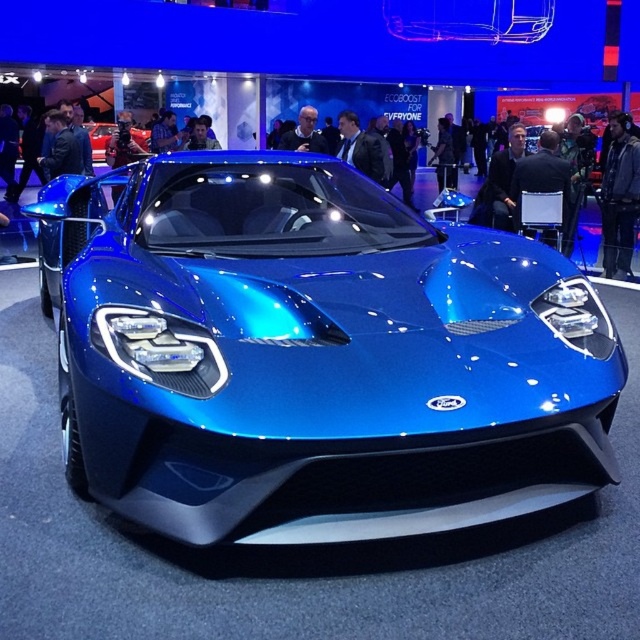
Question: Which point is farther to the camera?

Choices:
 (A) metallic blue car at center
 (B) metallic blue sports car at center

Answer: (A)

Question: Does metallic blue sports car at center appear under metallic blue car at center?

Choices:
 (A) yes
 (B) no

Answer: (A)

Question: Can you confirm if metallic blue sports car at center is wider than metallic blue car at center?

Choices:
 (A) no
 (B) yes

Answer: (B)

Question: Can you confirm if metallic blue sports car at center is thinner than metallic blue car at center?

Choices:
 (A) no
 (B) yes

Answer: (A)